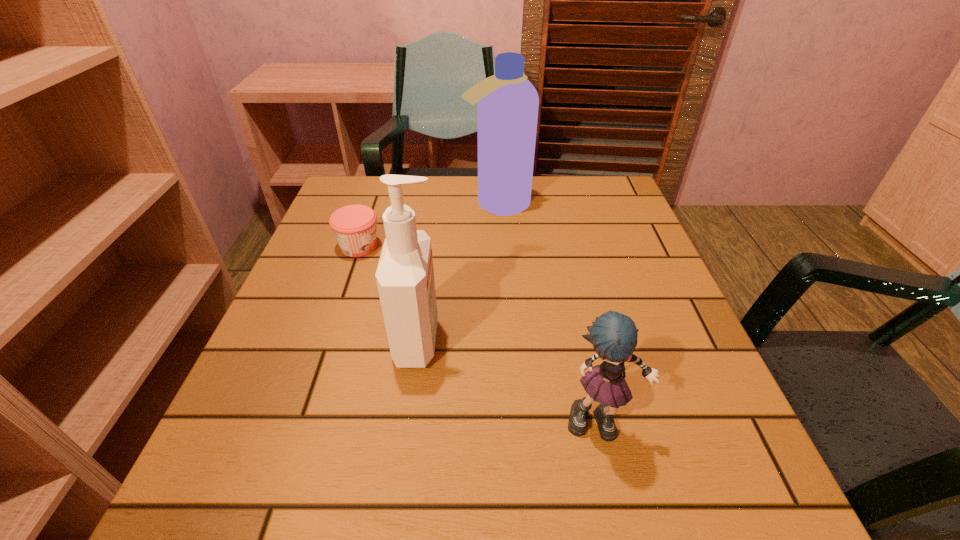
Identify which object is the second closest to the third tallest object. Please provide its 2D coordinates. Your answer should be formatted as a tuple, i.e. [(x, y)], where the tuple contains the x and y coordinates of a point satisfying the conditions above.

[(354, 226)]

Identify the location of vacant position in the image that satisfies the following two spatial constraints: 1. on the front side of the shampoo; 2. on the front label of the cleansing agent. (505, 341).